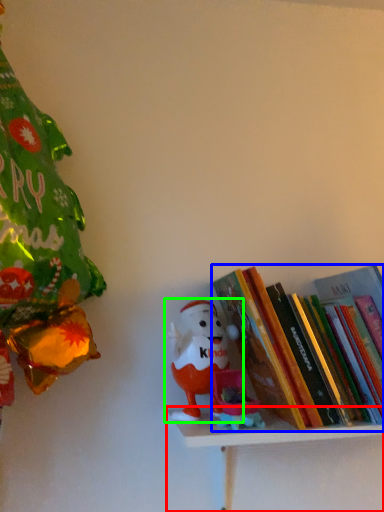
Question: Estimate the real-world distances between objects in this image. Which object is farther from shelf (highlighted by a red box), book (highlighted by a blue box) or toy (highlighted by a green box)?

Choices:
 (A) book
 (B) toy

Answer: (A)